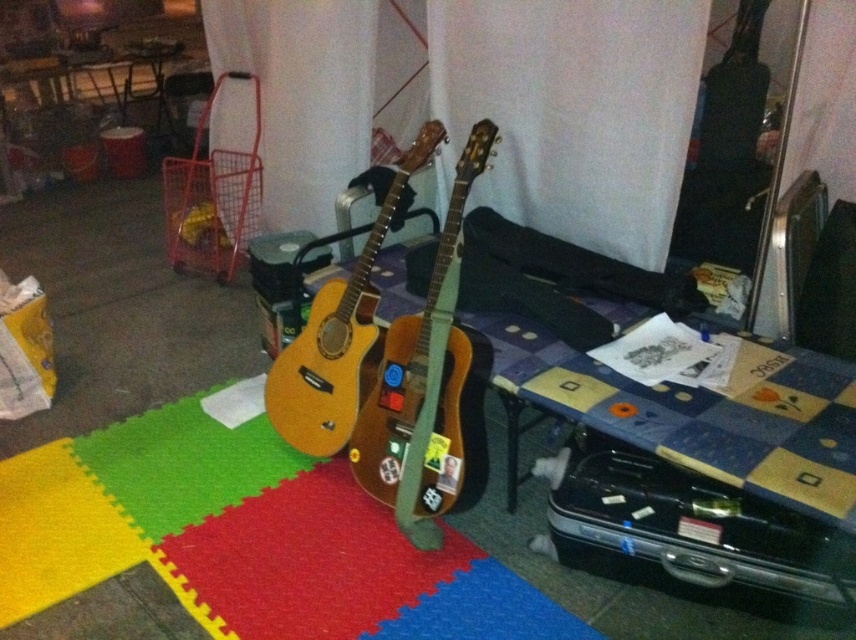
You are moving the wooden acoustic guitar at center and need to place it into the black hard case at lower right. Can the guitar fit vertically inside the case?

The black hard case at lower right is shorter than the wooden acoustic guitar at center, so the guitar cannot fit vertically inside the case.

You are standing in the storage area and want to pick up an item located at point (x=446, y=316) and another item at point (x=376, y=330). Which item will you reach first if you move towards them from your current position?

The item at point (x=446, y=316) will be reached first because it is closer to you than the item at point (x=376, y=330).